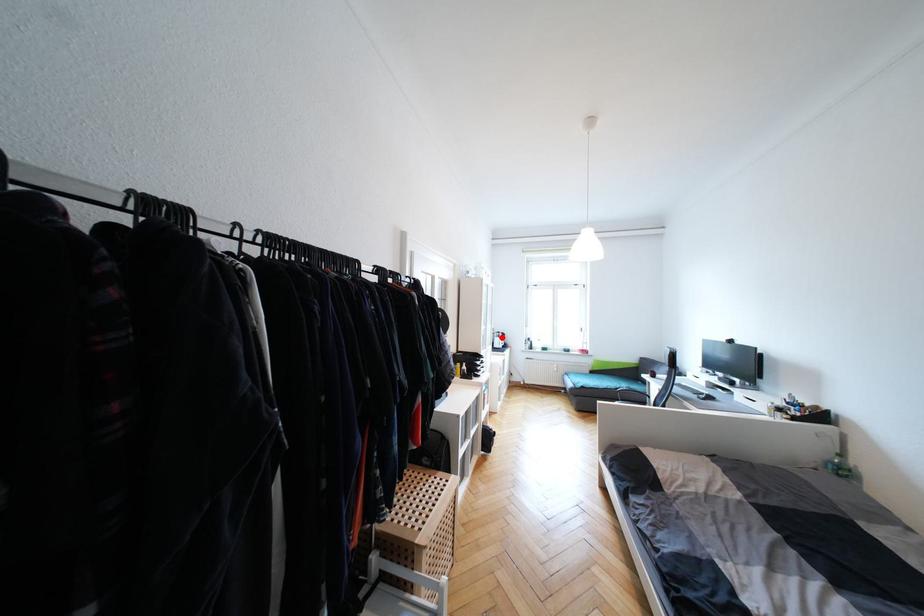
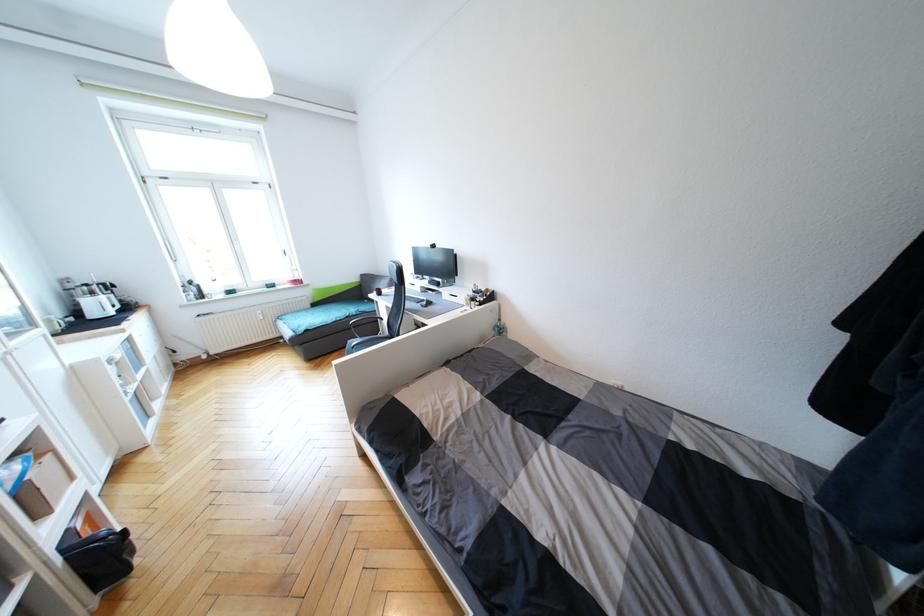
Question: I am providing you with two images of the same scene from different viewpoints. In image1, a red point is highlighted. Considering the same 3D point in image2, which of the following is correct?

Choices:
 (A) It is closer
 (B) It is farther

Answer: (A)